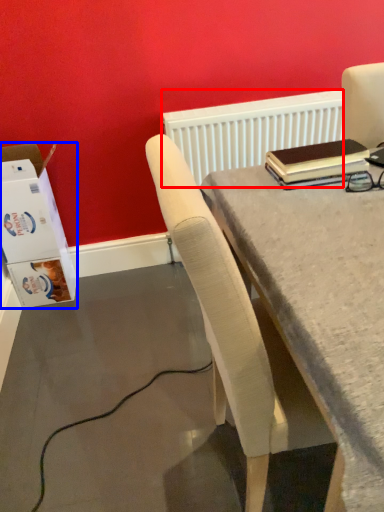
Question: Which object is closer to the camera taking this photo, radiator (highlighted by a red box) or box (highlighted by a blue box)?

Choices:
 (A) radiator
 (B) box

Answer: (B)